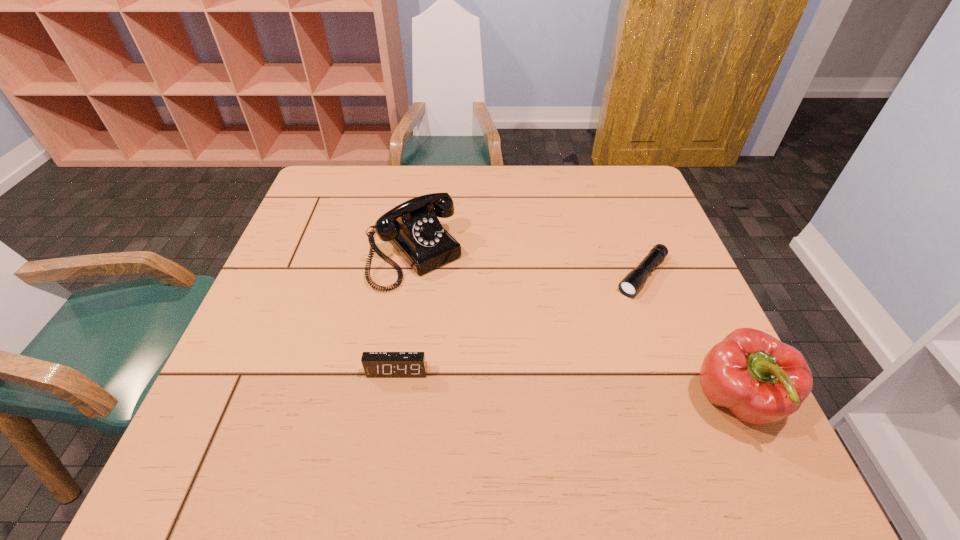
I want to click on free spot located at the lens end of the shortest object, so click(563, 371).

I want to click on free region located 0.280m at the lens end of the shortest object, so click(563, 371).

Image resolution: width=960 pixels, height=540 pixels. Identify the location of object that is at the near edge. click(761, 380).

Find the location of a particular element. pepper located in the right edge section of the desktop is located at coordinates (761, 380).

Locate an element on the screen. Image resolution: width=960 pixels, height=540 pixels. flashlight present at the right edge is located at coordinates (630, 285).

At what (x,y) coordinates should I click in order to perform the action: click on object situated at the near right corner. Please return your answer as a coordinate pair (x, y). The height and width of the screenshot is (540, 960). Looking at the image, I should click on (761, 380).

The width and height of the screenshot is (960, 540). In order to click on blank space at the far edge of the desktop in this screenshot , I will do `click(428, 167)`.

In the image, there is a desktop. At what (x,y) coordinates should I click in order to perform the action: click on blank space at the near edge. Please return your answer as a coordinate pair (x, y). Looking at the image, I should click on (523, 395).

You are a GUI agent. You are given a task and a screenshot of the screen. Output one action in this format:
    pyautogui.click(x=<x>, y=<y>)
    Task: Click on the vacant space at the left edge of the desktop
    
    Given the screenshot: What is the action you would take?
    pyautogui.click(x=232, y=370)

The image size is (960, 540). In order to click on free region at the right edge of the desktop in this screenshot , I will do `click(617, 252)`.